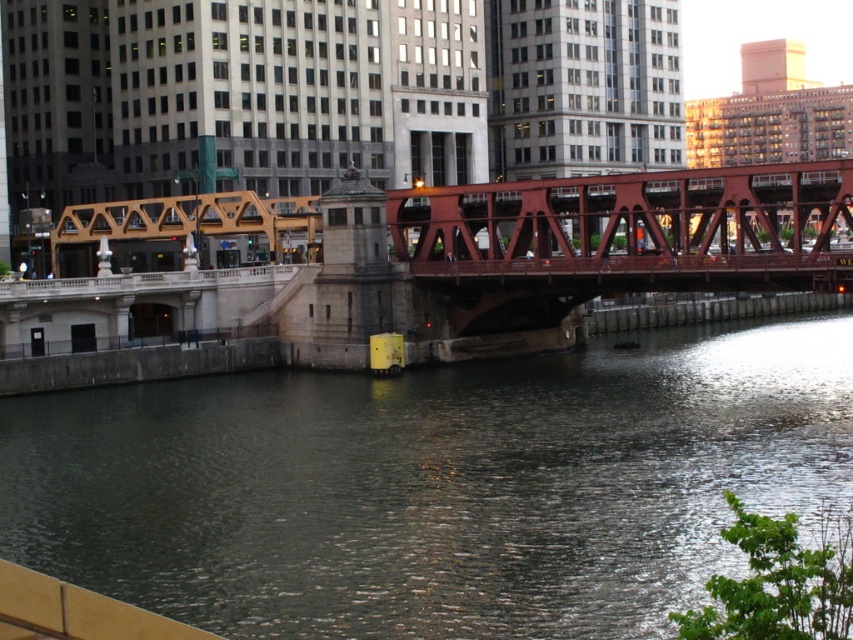
You are a photographer standing on the embankment on the left side of the image. You want to capture a photo of the red steel bridge at center and the dark green water at center. Which object should you focus on first if you want to include both in your frame?

The dark green water at center is located below the red steel bridge at center, so you should focus on the red steel bridge at center first to ensure both are in the frame.